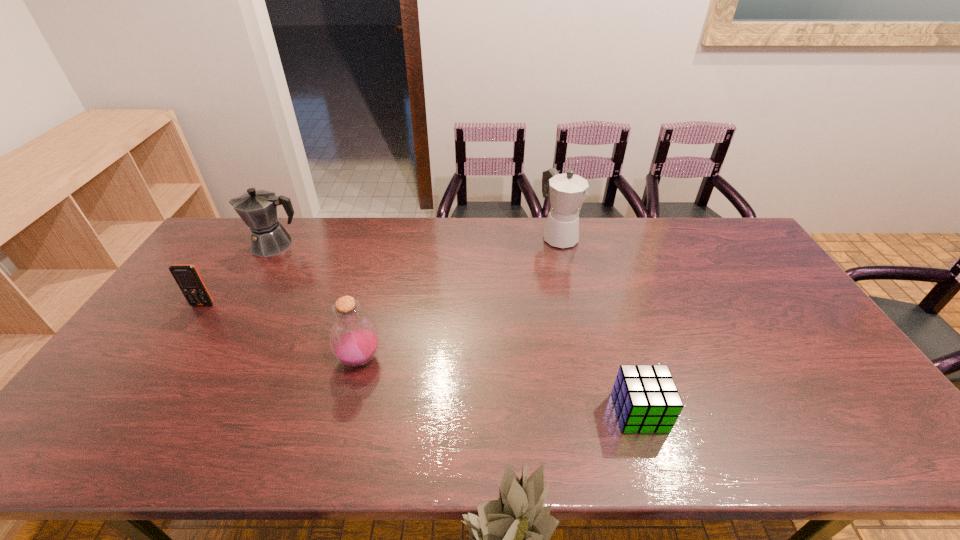
The width and height of the screenshot is (960, 540). Find the location of `free space at the left edge of the desktop`. free space at the left edge of the desktop is located at coordinates (208, 268).

Locate an element on the screen. This screenshot has width=960, height=540. free space at the right edge is located at coordinates (755, 306).

At what (x,y) coordinates should I click in order to perform the action: click on free location at the far right corner of the desktop. Please return your answer as a coordinate pair (x, y). This screenshot has height=540, width=960. Looking at the image, I should click on coord(698,222).

Identify the location of vacant area at the near right corner of the desktop. (872, 430).

You are a GUI agent. You are given a task and a screenshot of the screen. Output one action in this format:
    pyautogui.click(x=<x>, y=<y>)
    Task: Click on the vacant area that lies between the shorter coffeepot and the shortest object
    
    Given the screenshot: What is the action you would take?
    pyautogui.click(x=457, y=329)

You are a GUI agent. You are given a task and a screenshot of the screen. Output one action in this format:
    pyautogui.click(x=<x>, y=<y>)
    Task: Click on the unoccupied position between the nearest object and the left coffeepot
    This screenshot has width=960, height=540.
    Given the screenshot: What is the action you would take?
    pyautogui.click(x=457, y=329)

What are the coordinates of `vacant area that lies between the cube and the taller coffeepot` in the screenshot? It's located at (599, 325).

In order to click on empty location between the left coffeepot and the cellular telephone in this screenshot , I will do `click(239, 275)`.

Locate an element on the screen. The height and width of the screenshot is (540, 960). free space that is in between the taller coffeepot and the cellular telephone is located at coordinates pos(381,271).

What are the coordinates of `empty space that is in between the left coffeepot and the nearest object` in the screenshot? It's located at (457, 329).